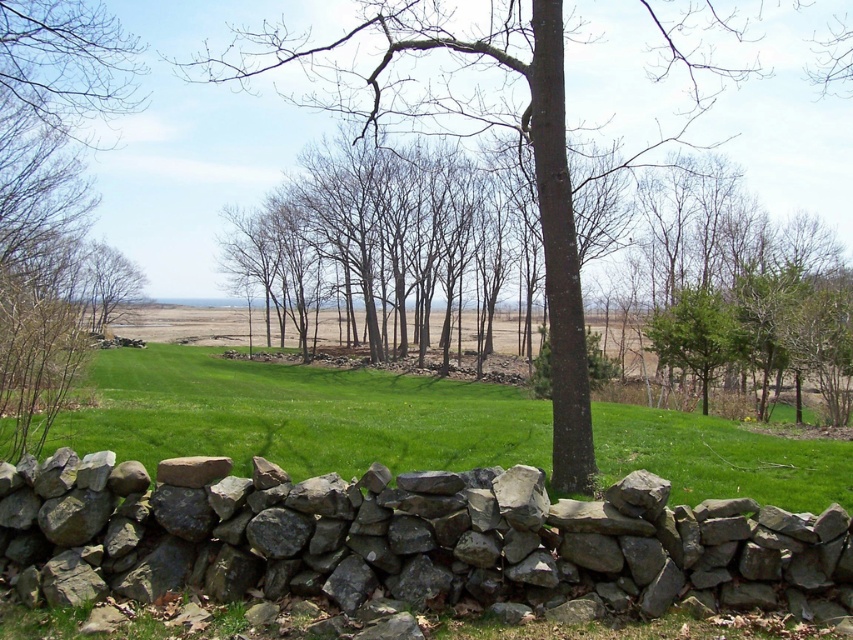
You are a bird looking for a place to perch. You see a brown rough bark tree at center and a bare branches at left. Which one is closer to you?

The brown rough bark tree at center is positioned over the bare branches at left, so the bare branches at left are closer to you.

In the scene shown: You are a gardener planning to plant flowers in the area shown. Considering the gray rough stone wall at center and the green grass at center, which one occupies a smaller area in the scene?

The gray rough stone wall at center is smaller than the green grass at center, so the gray rough stone wall at center occupies a smaller area in the scene.